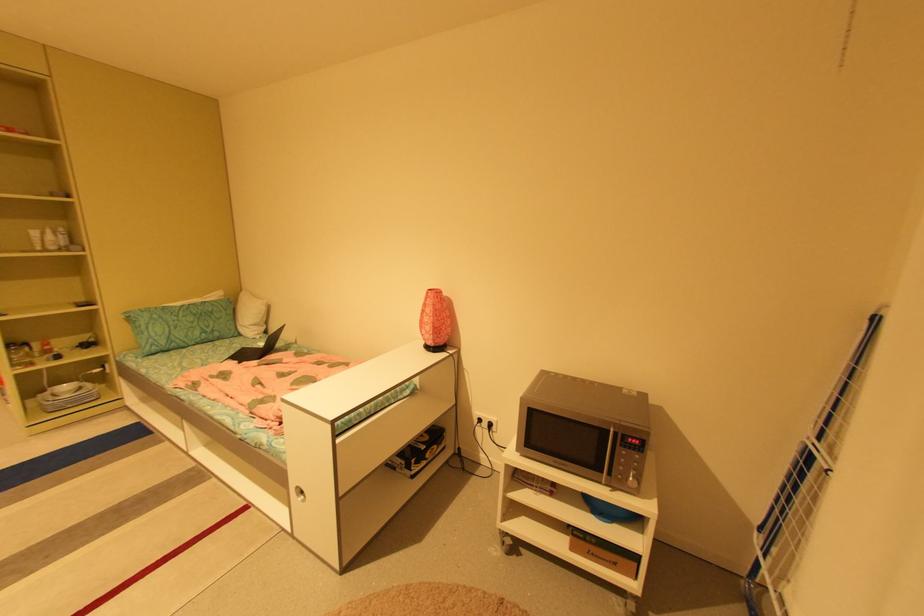
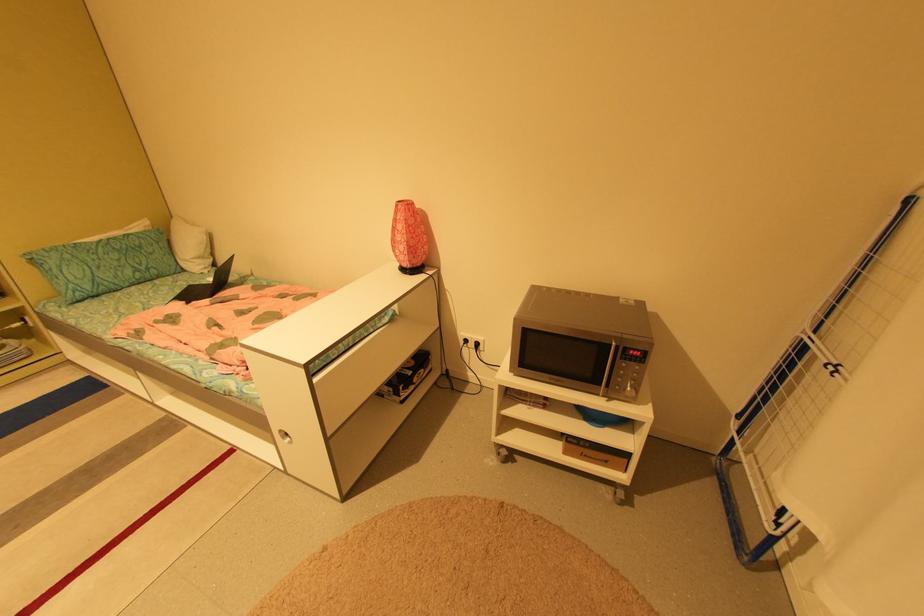
In the second image, find the point that corresponds to pixel 610 474 in the first image.

(606, 386)